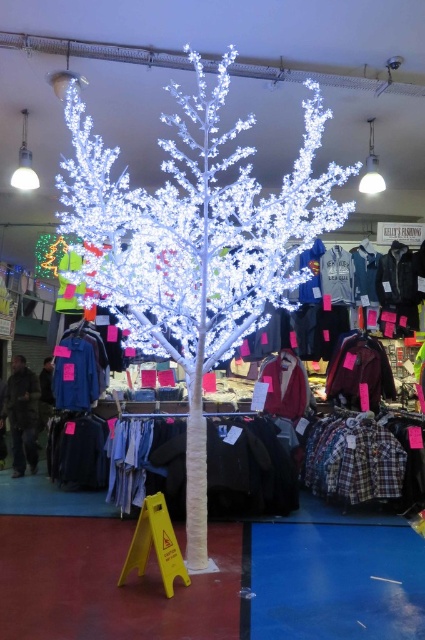
Question: In this image, where is velvet maroon jacket at center located relative to blue denim shirt at left?

Choices:
 (A) below
 (B) above

Answer: (B)

Question: Is velvet maroon jacket at center further to the viewer compared to dark brown leather jacket at left?

Choices:
 (A) yes
 (B) no

Answer: (B)

Question: Which point is farther from the camera taking this photo?

Choices:
 (A) (252, 326)
 (B) (371, 349)

Answer: (B)

Question: Is white textured tree at center above dark brown leather jacket at left?

Choices:
 (A) yes
 (B) no

Answer: (A)

Question: Which object appears closest to the camera in this image?

Choices:
 (A) dark brown leather jacket at left
 (B) blue denim shirt at left
 (C) velvet maroon jacket at center

Answer: (C)

Question: Which point is farther to the camera?

Choices:
 (A) velvet maroon jacket at center
 (B) blue denim shirt at left
 (C) white textured tree at center
 (D) dark brown leather jacket at left

Answer: (D)